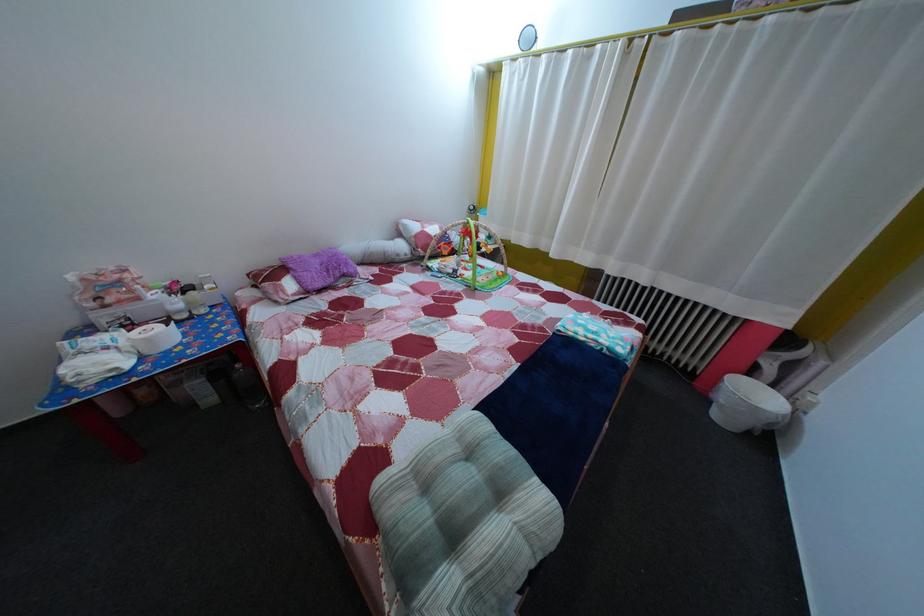
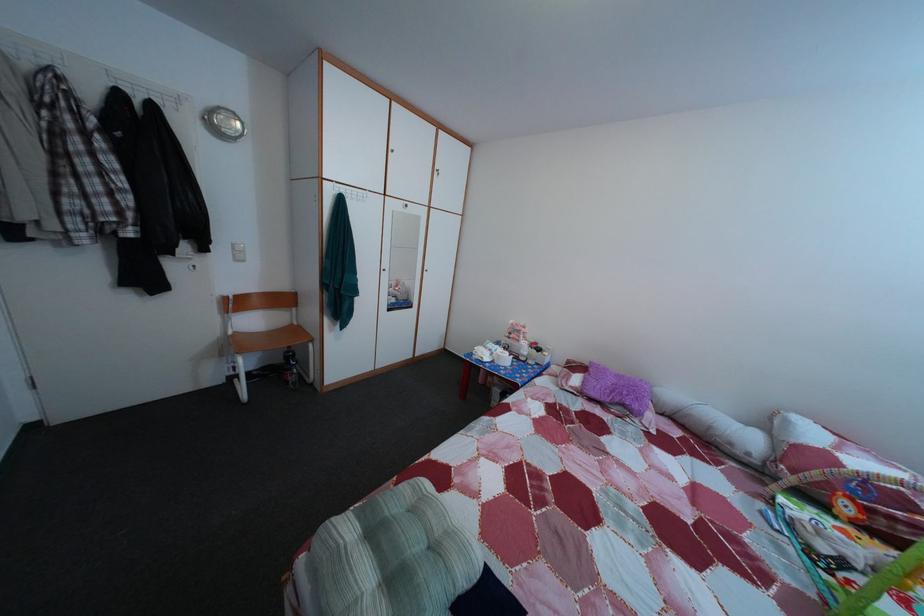
Question: The images are taken continuously from a first-person perspective. In which direction is your viewpoint rotating?

Choices:
 (A) Left
 (B) Right
 (C) Up
 (D) Down

Answer: (A)